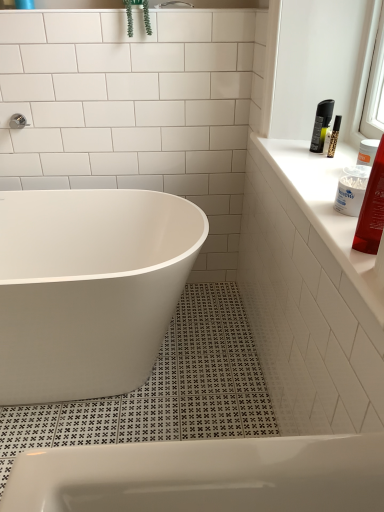
Question: From the image's perspective, is green leafy plant at upper center over shiny red plastic tube at upper right?

Choices:
 (A) no
 (B) yes

Answer: (B)

Question: From the image's perspective, is green leafy plant at upper center below shiny red plastic tube at upper right?

Choices:
 (A) no
 (B) yes

Answer: (A)

Question: Can we say green leafy plant at upper center lies outside shiny red plastic tube at upper right?

Choices:
 (A) no
 (B) yes

Answer: (B)

Question: Would you say shiny red plastic tube at upper right is part of green leafy plant at upper center's contents?

Choices:
 (A) yes
 (B) no

Answer: (B)

Question: Considering the relative sizes of green leafy plant at upper center and shiny red plastic tube at upper right in the image provided, is green leafy plant at upper center thinner than shiny red plastic tube at upper right?

Choices:
 (A) yes
 (B) no

Answer: (B)

Question: Considering the relative positions of white plastic cotton swab container at upper right and white glossy countertop at upper right in the image provided, is white plastic cotton swab container at upper right to the left or to the right of white glossy countertop at upper right?

Choices:
 (A) right
 (B) left

Answer: (B)

Question: Considering the positions of white plastic cotton swab container at upper right and white glossy countertop at upper right in the image, is white plastic cotton swab container at upper right wider or thinner than white glossy countertop at upper right?

Choices:
 (A) thin
 (B) wide

Answer: (A)

Question: Is white plastic cotton swab container at upper right taller or shorter than white glossy countertop at upper right?

Choices:
 (A) tall
 (B) short

Answer: (A)

Question: From a real-world perspective, is white plastic cotton swab container at upper right positioned above or below white glossy countertop at upper right?

Choices:
 (A) above
 (B) below

Answer: (A)

Question: Considering their positions, is green leafy plant at upper center located in front of or behind white plastic cotton swab container at upper right?

Choices:
 (A) front
 (B) behind

Answer: (B)

Question: Is green leafy plant at upper center taller or shorter than white plastic cotton swab container at upper right?

Choices:
 (A) tall
 (B) short

Answer: (A)

Question: Visually, is green leafy plant at upper center positioned to the left or to the right of white plastic cotton swab container at upper right?

Choices:
 (A) left
 (B) right

Answer: (A)

Question: Is green leafy plant at upper center wider or thinner than white plastic cotton swab container at upper right?

Choices:
 (A) thin
 (B) wide

Answer: (B)

Question: Considering the relative positions of shiny red plastic tube at upper right and white glossy bathtub at center in the image provided, is shiny red plastic tube at upper right to the left or to the right of white glossy bathtub at center?

Choices:
 (A) right
 (B) left

Answer: (A)

Question: Does point (367, 217) appear closer or farther from the camera than point (74, 257)?

Choices:
 (A) closer
 (B) farther

Answer: (A)